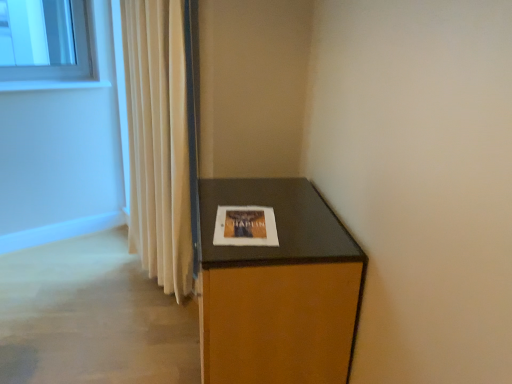
Question: Considering the positions of matte white picture frame at center and beige fabric curtain at left in the image, is matte white picture frame at center wider or thinner than beige fabric curtain at left?

Choices:
 (A) thin
 (B) wide

Answer: (B)

Question: From the image's perspective, is matte white picture frame at center positioned above or below beige fabric curtain at left?

Choices:
 (A) above
 (B) below

Answer: (B)

Question: Estimate the real-world distances between objects in this image. Which object is farther from the brown wood cabinet at lower right?

Choices:
 (A) matte white picture frame at center
 (B) beige fabric curtain at left
 (C) white glossy window sill at upper left

Answer: (C)

Question: Estimate the real-world distances between objects in this image. Which object is farther from the white glossy window sill at upper left?

Choices:
 (A) matte white picture frame at center
 (B) brown wood cabinet at lower right
 (C) beige fabric curtain at left

Answer: (B)